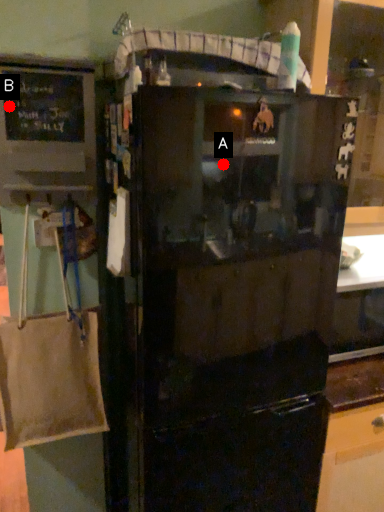
Question: Two points are circled on the image, labeled by A and B beside each circle. Which point appears closest to the camera in this image?

Choices:
 (A) A is closer
 (B) B is closer

Answer: (A)